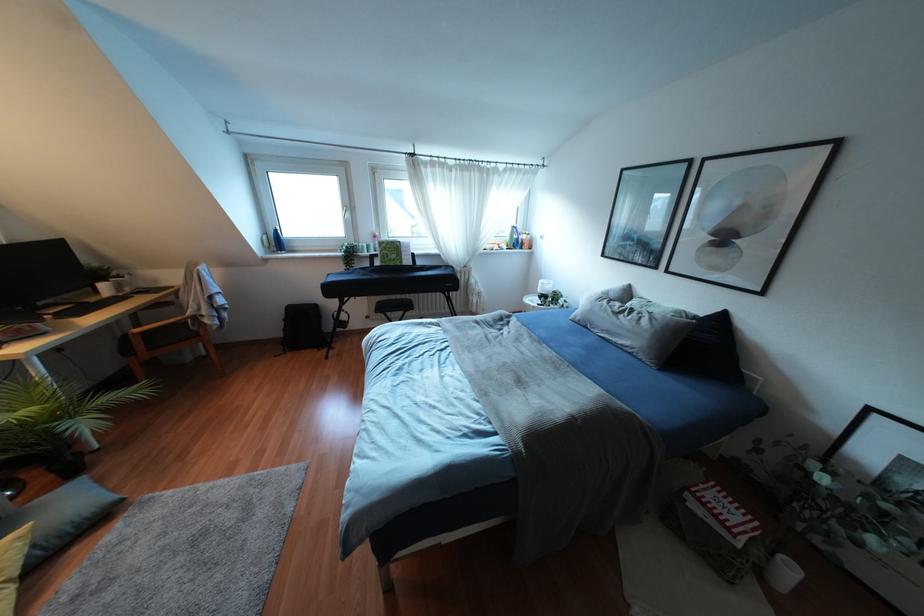
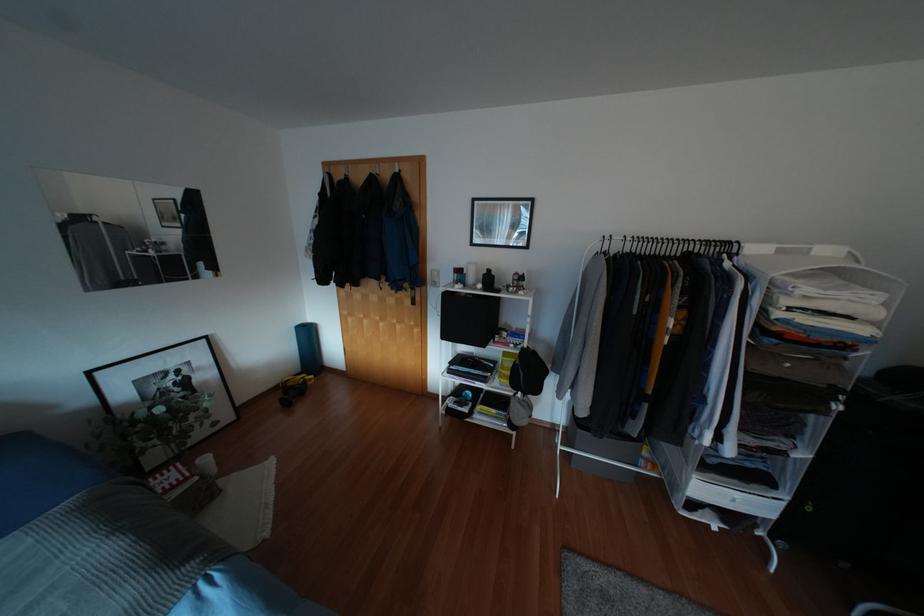
Locate, in the second image, the point that corresponds to the point at 791,570 in the first image.

(205, 459)